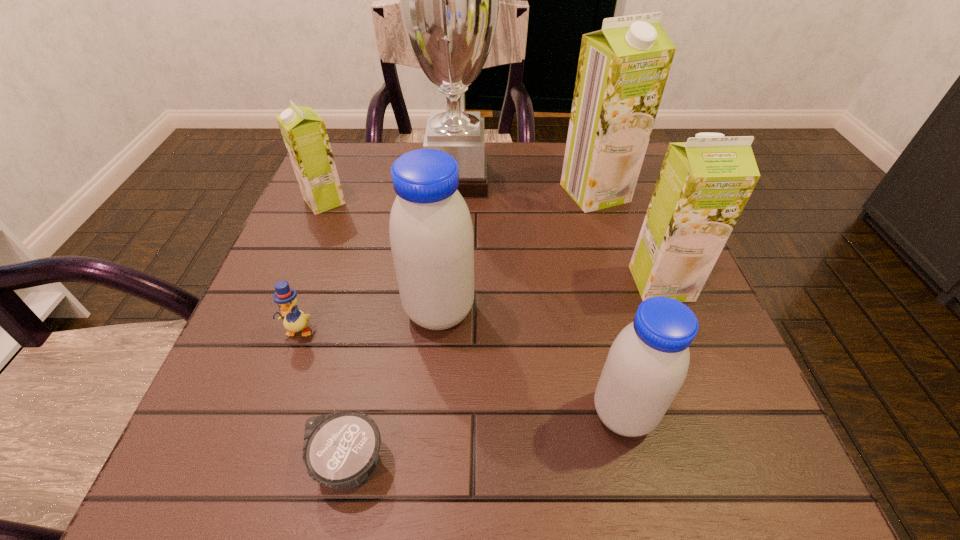
At what (x,y) coordinates should I click in order to perform the action: click on vacant position located 0.110m on the right of the yogurt. Please return your answer as a coordinate pair (x, y). The height and width of the screenshot is (540, 960). Looking at the image, I should click on (468, 463).

At what (x,y) coordinates should I click in order to perform the action: click on trophy cup situated at the far edge. Please return your answer as a coordinate pair (x, y). Looking at the image, I should click on (449, 0).

Find the location of `soya milk that is at the near edge`. soya milk that is at the near edge is located at coordinates (647, 364).

At what (x,y) coordinates should I click in order to perform the action: click on yogurt present at the near edge. Please return your answer as a coordinate pair (x, y). Looking at the image, I should click on (340, 450).

Find the location of a particular element. The image size is (960, 540). soya milk located at the left edge is located at coordinates (303, 130).

The height and width of the screenshot is (540, 960). I want to click on duckling positioned at the left edge, so click(294, 320).

Where is `object positioned at the far left corner`? Image resolution: width=960 pixels, height=540 pixels. object positioned at the far left corner is located at coordinates (303, 130).

This screenshot has width=960, height=540. Identify the location of object positioned at the far right corner. (622, 71).

Where is `object that is positioned at the near right corner`? The height and width of the screenshot is (540, 960). object that is positioned at the near right corner is located at coordinates (647, 364).

In the image, there is a desktop. Identify the location of vacant region at the far edge. (533, 168).